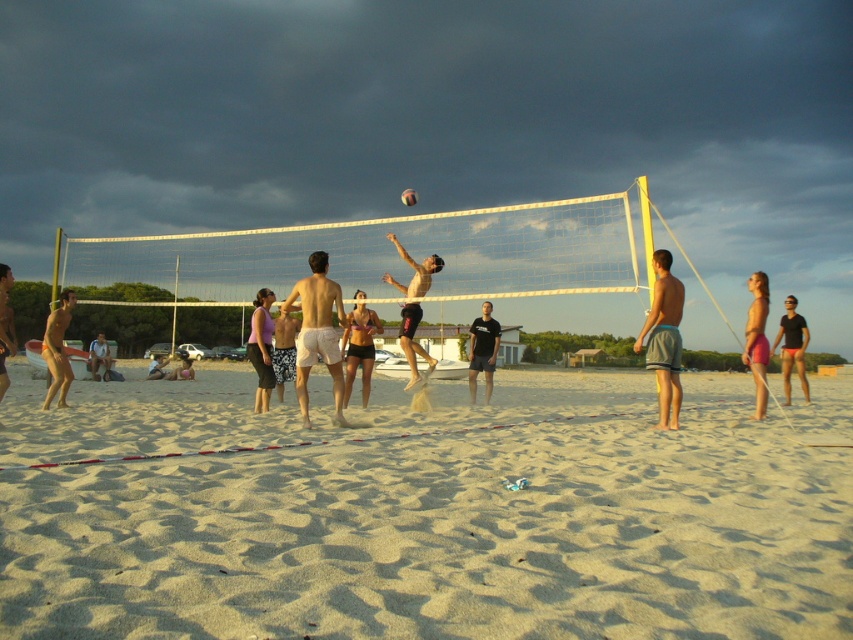
Between gray shorts at center and black matte shorts at center, which one is positioned lower?

black matte shorts at center is below.

Which is behind, point (659, 317) or point (479, 336)?

Positioned behind is point (479, 336).

Where is `gray shorts at center`? This screenshot has height=640, width=853. gray shorts at center is located at coordinates (664, 339).

From the picture: Who is more distant from viewer, (328, 337) or (408, 205)?

Positioned behind is point (408, 205).

Consider the image. Is white matte shorts at center smaller than multicolored rubber volleyball at center?

Correct, white matte shorts at center occupies less space than multicolored rubber volleyball at center.

This screenshot has height=640, width=853. Describe the element at coordinates (317, 332) in the screenshot. I see `white matte shorts at center` at that location.

Where is `white matte shorts at center`? The height and width of the screenshot is (640, 853). white matte shorts at center is located at coordinates (317, 332).

Which of these two, pink fabric shorts at right or black fabric shorts at right, stands shorter?

black fabric shorts at right

Is pink fabric shorts at right below black fabric shorts at right?

No, pink fabric shorts at right is not below black fabric shorts at right.

Locate an element on the screen. pink fabric shorts at right is located at coordinates (757, 339).

Identify the location of pink fabric shorts at right. The width and height of the screenshot is (853, 640). (757, 339).